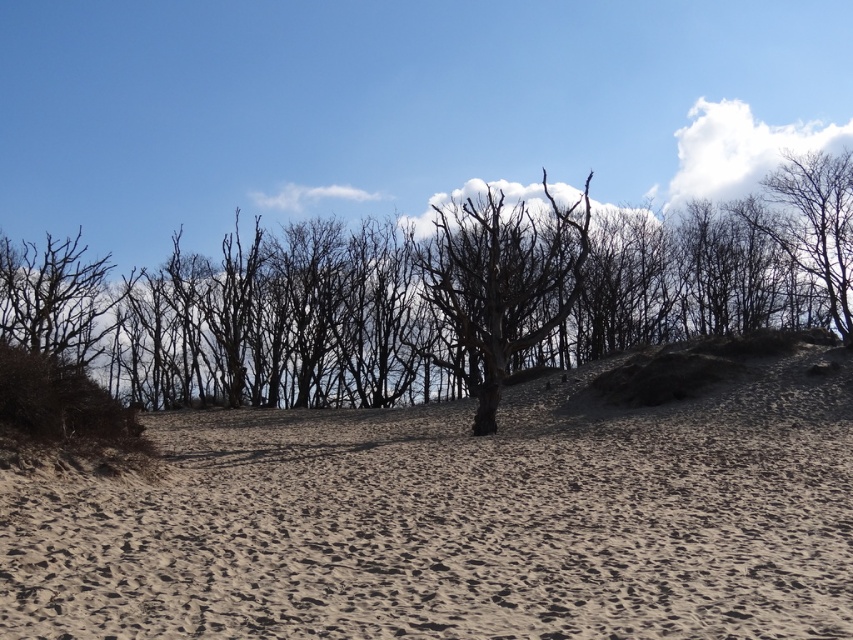
You are a hiker trying to navigate to the smooth beige sand at center. Based on the scene description, where would you find the smooth beige sand?

The smooth beige sand at center is located at point [457,522] in the image coordinates.

You are a hiker trying to navigate through the smooth beige sand at center and the bare branches at upper right. Which of these two objects is shorter in height?

The smooth beige sand at center is not as tall as the bare branches at upper right, so the smooth beige sand at center is shorter in height.

You are an explorer navigating a desert landscape. You need to reach the oasis located near the bare branches at upper right. However, your vehicle can only travel on the smooth beige sand at center. Based on the scene description, can you determine if your path to the oasis is blocked by any obstacles?

The smooth beige sand at center is to the left of bare branches at upper right, so the path to the oasis near the bare branches at upper right is not blocked by any obstacles since the sand provides a clear route to the right.